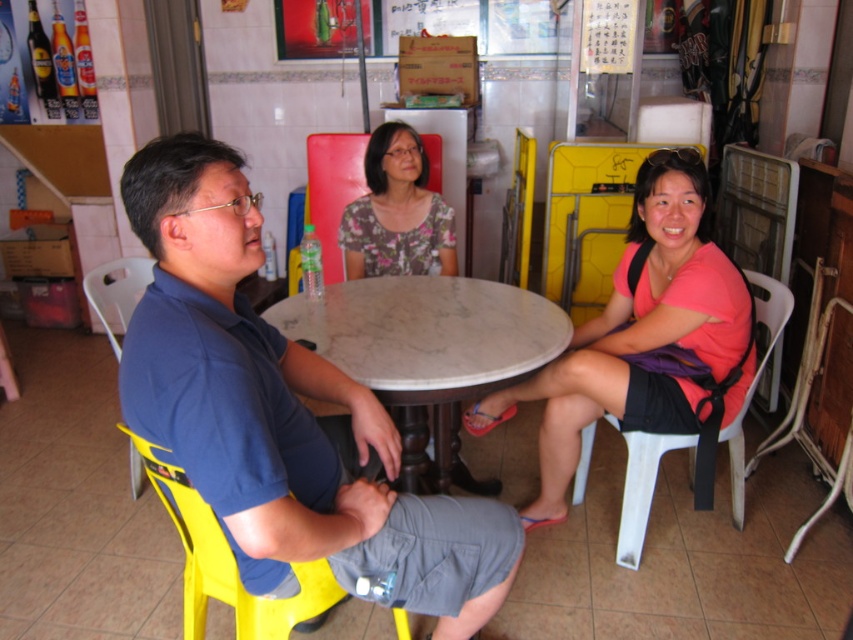
Is floral fabric blouse at center to the right of white plastic chair at right from the viewer's perspective?

Incorrect, floral fabric blouse at center is not on the right side of white plastic chair at right.

Who is more forward, (x=442, y=253) or (x=695, y=440)?

Point (x=695, y=440)

Find the location of a particular element. floral fabric blouse at center is located at coordinates (397, 212).

Does pink fabric shirt at center appear on the left side of white plastic chair at right?

Indeed, pink fabric shirt at center is positioned on the left side of white plastic chair at right.

Does pink fabric shirt at center appear over white plastic chair at right?

Yes, pink fabric shirt at center is above white plastic chair at right.

Between point (668, 323) and point (618, 544), which one is positioned in front?

Point (668, 323) is in front.

This screenshot has width=853, height=640. What are the coordinates of `pink fabric shirt at center` in the screenshot? It's located at (641, 336).

Is the position of blue fabric shirt at center more distant than that of white marble table at center?

No, it is in front of white marble table at center.

Can you confirm if blue fabric shirt at center is shorter than white marble table at center?

In fact, blue fabric shirt at center may be taller than white marble table at center.

The image size is (853, 640). I want to click on blue fabric shirt at center, so click(281, 412).